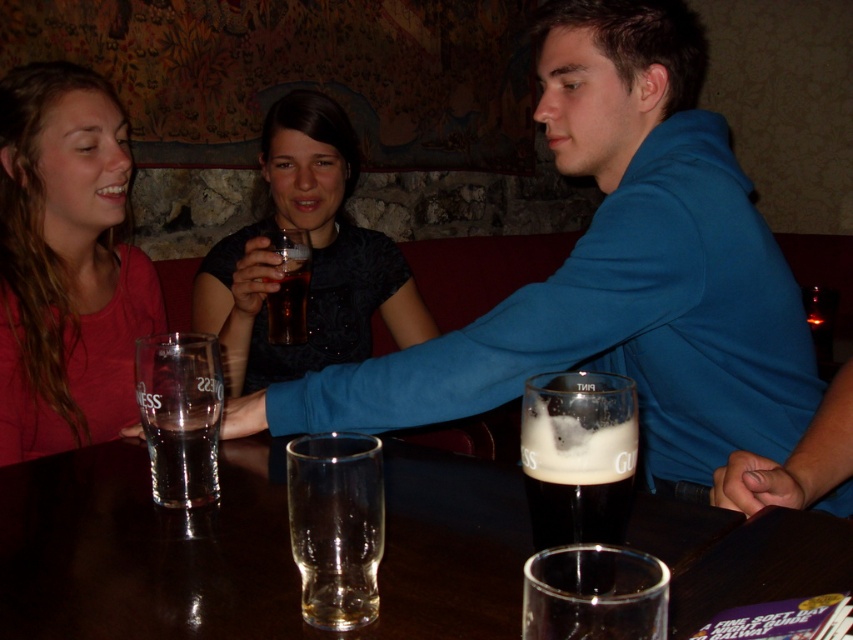
Does blue cotton shirt at upper right lie behind clear glass at center?

Yes, it is.

The height and width of the screenshot is (640, 853). What do you see at coordinates (614, 273) in the screenshot? I see `blue cotton shirt at upper right` at bounding box center [614, 273].

The height and width of the screenshot is (640, 853). Find the location of `blue cotton shirt at upper right`. blue cotton shirt at upper right is located at coordinates (614, 273).

Find the location of `clear glass beer at center`. clear glass beer at center is located at coordinates (183, 454).

The width and height of the screenshot is (853, 640). Find the location of `clear glass beer at center`. clear glass beer at center is located at coordinates (183, 454).

Who is more distant from viewer, (20, 228) or (561, 404)?

The point (20, 228) is more distant.

Image resolution: width=853 pixels, height=640 pixels. Find the location of `matte pink shirt at upper left`. matte pink shirt at upper left is located at coordinates (67, 262).